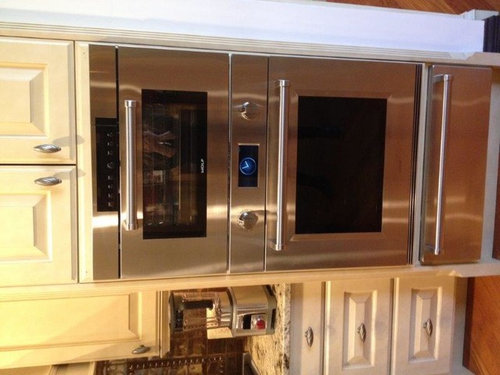
What are the coordinates of `handle` in the screenshot? It's located at (146, 350), (51, 184), (49, 148).